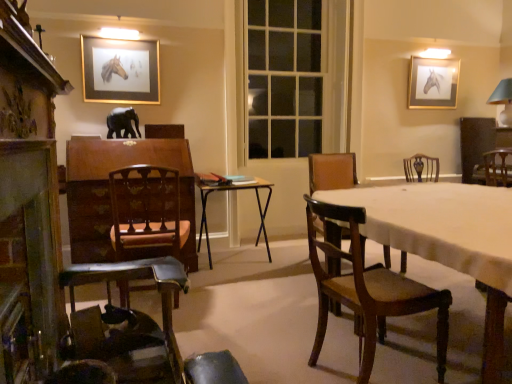
Question: Looking at the image, does wooden chair at left, marked as the 3th chair in a front-to-back arrangement, seem bigger or smaller compared to wooden chair at right, positioned as the first chair in right-to-left order?

Choices:
 (A) big
 (B) small

Answer: (A)

Question: In terms of height, does wooden chair at left, the third chair in the back-to-front sequence, look taller or shorter compared to wooden chair at right, the 5th chair from the left?

Choices:
 (A) tall
 (B) short

Answer: (A)

Question: Based on their relative distances, which object is nearer to the gold-framed picture at upper center, which is counted as the 2th picture frame, starting from the right?

Choices:
 (A) mahogany wood chair at center, the fifth chair in the back-to-front sequence
 (B) brown wood armchair at center
 (C) matte gray lampshade at upper right
 (D) wooden chair at lower left, the 2th chair in the front-to-back sequence
 (E) gold-framed picture of horse at upper right, which is the second picture frame from left to right

Answer: (B)

Question: Estimate the real-world distances between objects in this image. Which object is farther from the wooden chair at right, the first chair viewed from the back?

Choices:
 (A) mahogany wood chair at center, arranged as the third chair when viewed from the right
 (B) white glass window at center
 (C) gold-framed picture of horse at upper right, positioned as the 1th picture frame in right-to-left order
 (D) black matte elephant at center
 (E) wooden mantelpiece at left

Answer: (E)